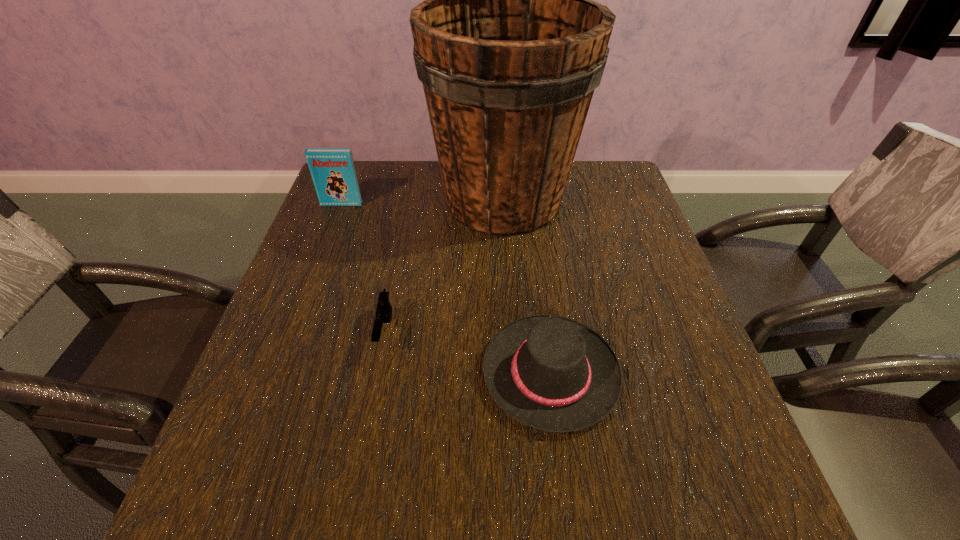
In order to click on free point between the third tallest object and the book in this screenshot , I will do `click(446, 288)`.

At what (x,y) coordinates should I click in order to perform the action: click on vacant area that lies between the leftmost object and the dress hat. Please return your answer as a coordinate pair (x, y). This screenshot has height=540, width=960. Looking at the image, I should click on (446, 288).

Identify the location of empty space that is in between the third shortest object and the pistol. Image resolution: width=960 pixels, height=540 pixels. (363, 268).

The width and height of the screenshot is (960, 540). I want to click on vacant area between the third tallest object and the second tallest object, so click(446, 288).

I want to click on free spot between the bucket and the third shortest object, so click(x=422, y=202).

Find the location of a particular element. The height and width of the screenshot is (540, 960). free spot between the pistol and the second tallest object is located at coordinates click(x=363, y=268).

Locate an element on the screen. The height and width of the screenshot is (540, 960). free space between the third tallest object and the second object from left to right is located at coordinates (468, 353).

The width and height of the screenshot is (960, 540). I want to click on vacant area that lies between the leftmost object and the third tallest object, so click(446, 288).

This screenshot has height=540, width=960. I want to click on free point between the pistol and the book, so click(363, 268).

The image size is (960, 540). I want to click on empty space between the dress hat and the third object from right to left, so click(468, 353).